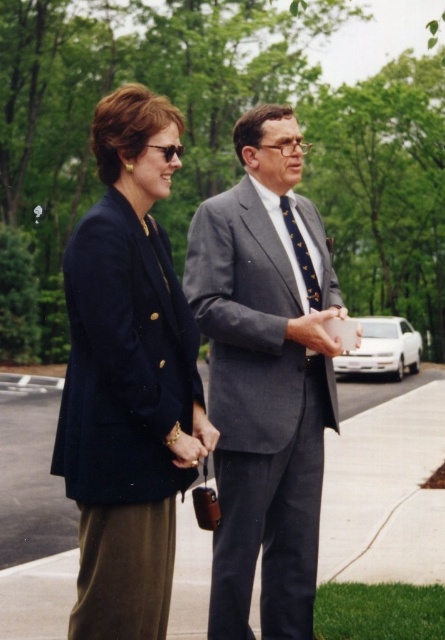
You are standing at the point marked as point (x=385, y=483) in the image. What is the material of the surface you are standing on?

The surface at point (x=385, y=483) is gray concrete pavement at center.

You are standing 10 feet away from the camera. You want to reach the navy blue blazer at left quickly. Can you reach it without moving your feet?

The navy blue blazer at left is 9.72 feet from the camera. Since you are standing 10 feet away from the camera, you are slightly farther than the blazer. You might need to take a small step forward to reach it.

You are standing in front of the two people in the image. You want to hand a gift to the person on the right. Which object from the scene is closer to you, the gray concrete pavement at center or the dark blue textured tie at center?

The gray concrete pavement at center is closer to you than the dark blue textured tie at center, so you should aim for the person on the right but keep in mind the pavement is nearer.